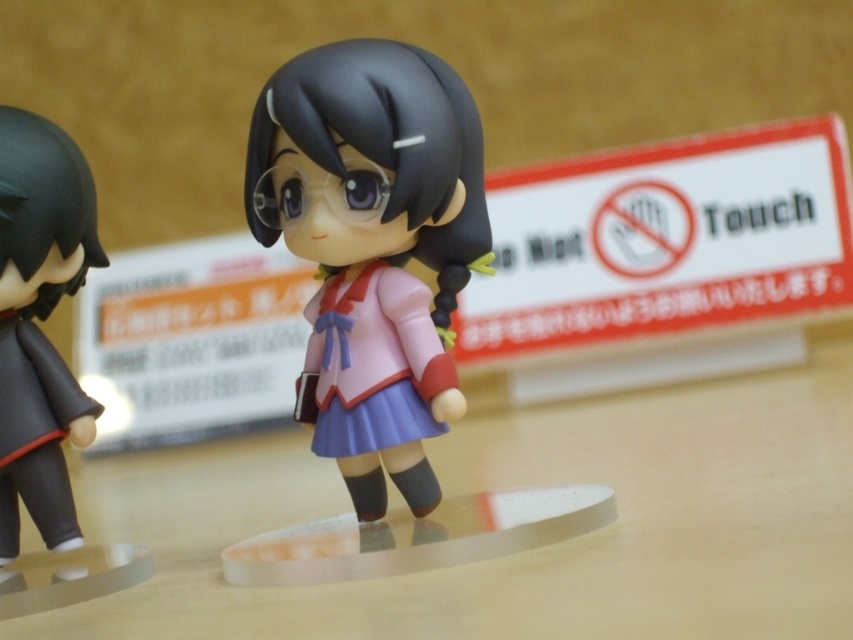
You are a collector who wants to display both the matte plastic doll at center and the matte black figure at left on a shelf. The shelf has a maximum width of 10 inches. Can both figurines fit side by side on the shelf without overlapping?

The distance between the matte plastic doll at center and the matte black figure at left is 10.29 inches, which exceeds the shelf width of 10 inches. Therefore, the two figurines cannot fit side by side on the shelf without overlapping.

You are organizing a display shelf and need to place both the matte plastic doll at center and the matte black figure at left. Since space is limited, which one should you place first to ensure both fit properly?

The matte plastic doll at center is smaller in size compared to the matte black figure at left. Therefore, you should place the larger matte black figure at left first to ensure both fit properly on the shelf.